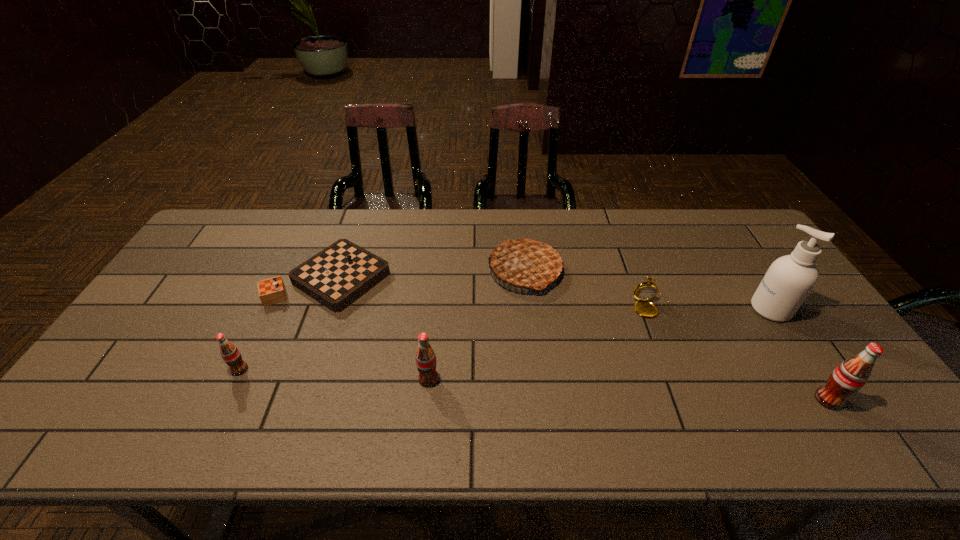
I want to click on empty space that is in between the nearest object and the cleansing agent, so click(800, 354).

Where is `vacant space in between the pie and the rightmost soda`? Image resolution: width=960 pixels, height=540 pixels. vacant space in between the pie and the rightmost soda is located at coordinates (x=677, y=335).

Locate which object is the fourth closest to the chessboard. Please provide its 2D coordinates. Your answer should be formatted as a tuple, i.e. [(x, y)], where the tuple contains the x and y coordinates of a point satisfying the conditions above.

[(644, 291)]

Locate which object ranks sixth in proximity to the chessboard. Please provide its 2D coordinates. Your answer should be formatted as a tuple, i.e. [(x, y)], where the tuple contains the x and y coordinates of a point satisfying the conditions above.

[(850, 376)]

Find the location of a particular element. Image resolution: width=960 pixels, height=540 pixels. soda that is the third closest to the second shortest object is located at coordinates (229, 352).

You are a GUI agent. You are given a task and a screenshot of the screen. Output one action in this format:
    pyautogui.click(x=<x>, y=<y>)
    Task: Click on the soda that is the second nearest to the cleansing agent
    This screenshot has width=960, height=540.
    Given the screenshot: What is the action you would take?
    pyautogui.click(x=426, y=362)

The width and height of the screenshot is (960, 540). I want to click on vacant space that satisfies the following two spatial constraints: 1. on the front label of the tallest object; 2. on the front side of the leftmost soda, so click(x=810, y=370).

This screenshot has width=960, height=540. In order to click on vacant space that satisfies the following two spatial constraints: 1. on the face of the pocket watch; 2. on the left side of the nearest object in this screenshot , I will do `click(688, 400)`.